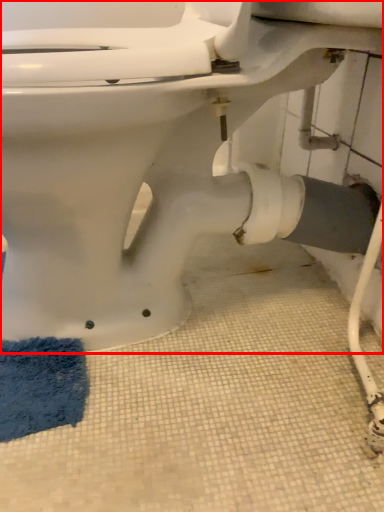
Question: From the image's perspective, where is toilet (annotated by the red box) located relative to bath mat?

Choices:
 (A) above
 (B) below

Answer: (A)